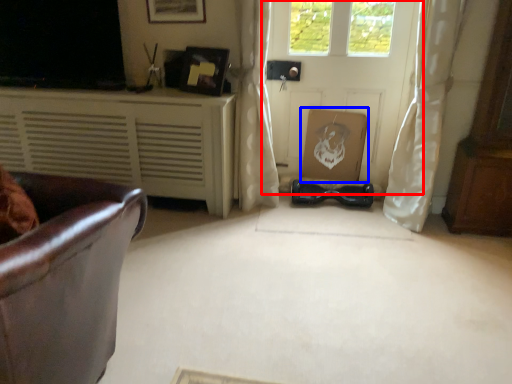
Question: Which of the following is the closest to the observer, door (highlighted by a red box) or cardboard box (highlighted by a blue box)?

Choices:
 (A) door
 (B) cardboard box

Answer: (A)